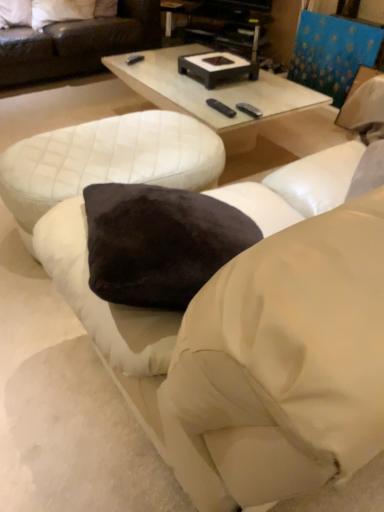
Question: From a real-world perspective, is white glossy coffee table at center positioned above or below velvet dark brown pillow at upper left, placed as the 1th pillow when sorted from left to right?

Choices:
 (A) below
 (B) above

Answer: (A)

Question: Is white glossy coffee table at center in front of or behind velvet dark brown pillow at upper left, the 2th pillow in the right-to-left sequence, in the image?

Choices:
 (A) front
 (B) behind

Answer: (A)

Question: Based on their relative distances, which object is farther from the white quilted ottoman at lower left?

Choices:
 (A) black plastic entertainment center at upper center
 (B) black leather couch at upper left
 (C) white soft pillow at upper left, the 2th pillow in the left-to-right sequence
 (D) velvet dark brown pillow at upper left, placed as the 1th pillow when sorted from left to right
 (E) white glossy coffee table at center

Answer: (D)

Question: Considering the real-world distances, which object is closest to the white soft pillow at upper left, the 2th pillow in the left-to-right sequence?

Choices:
 (A) black leather couch at upper left
 (B) white quilted ottoman at lower left
 (C) black plastic entertainment center at upper center
 (D) velvet dark brown pillow at upper left, the 2th pillow in the right-to-left sequence
 (E) white glossy coffee table at center

Answer: (D)